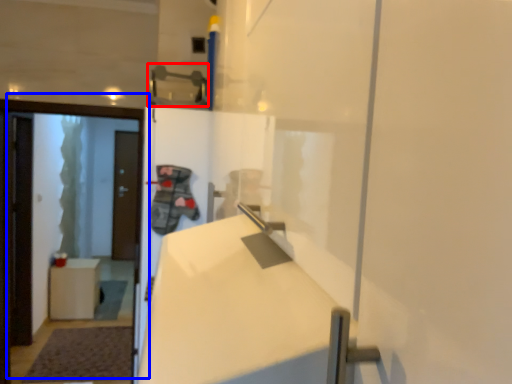
Question: Which point is further to the camera, door handle (highlighted by a red box) or door (highlighted by a blue box)?

Choices:
 (A) door handle
 (B) door

Answer: (B)